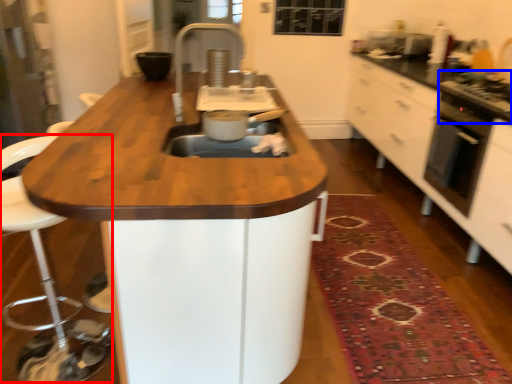
Question: Which object appears farthest to the camera in this image, swivel chair (highlighted by a red box) or gas stove (highlighted by a blue box)?

Choices:
 (A) swivel chair
 (B) gas stove

Answer: (B)